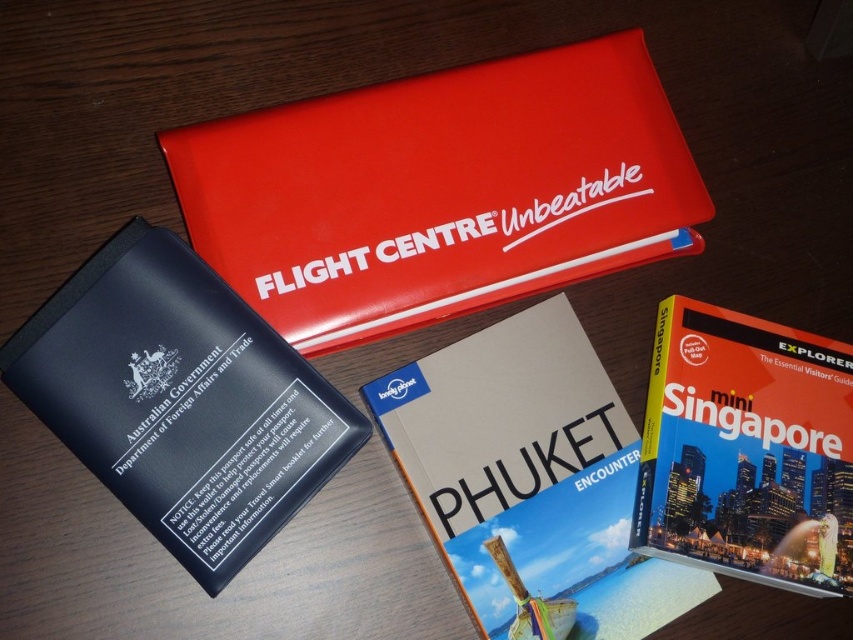
Question: Is hardcover book at center further to camera compared to hardcover book at upper right?

Choices:
 (A) no
 (B) yes

Answer: (B)

Question: Estimate the real-world distances between objects in this image. Which object is farther from the hardcover book at upper right?

Choices:
 (A) glossy plastic binder at upper center
 (B) matte black passport at upper left
 (C) hardcover book at center

Answer: (B)

Question: Does matte black passport at upper left have a larger size compared to hardcover book at center?

Choices:
 (A) no
 (B) yes

Answer: (A)

Question: Is glossy plastic binder at upper center thinner than hardcover book at upper right?

Choices:
 (A) yes
 (B) no

Answer: (B)

Question: Which object is farther from the camera taking this photo?

Choices:
 (A) glossy plastic binder at upper center
 (B) hardcover book at upper right

Answer: (A)

Question: Which point is closer to the camera?

Choices:
 (A) (142, 280)
 (B) (200, 188)
 (C) (827, 570)
 (D) (532, 467)

Answer: (C)